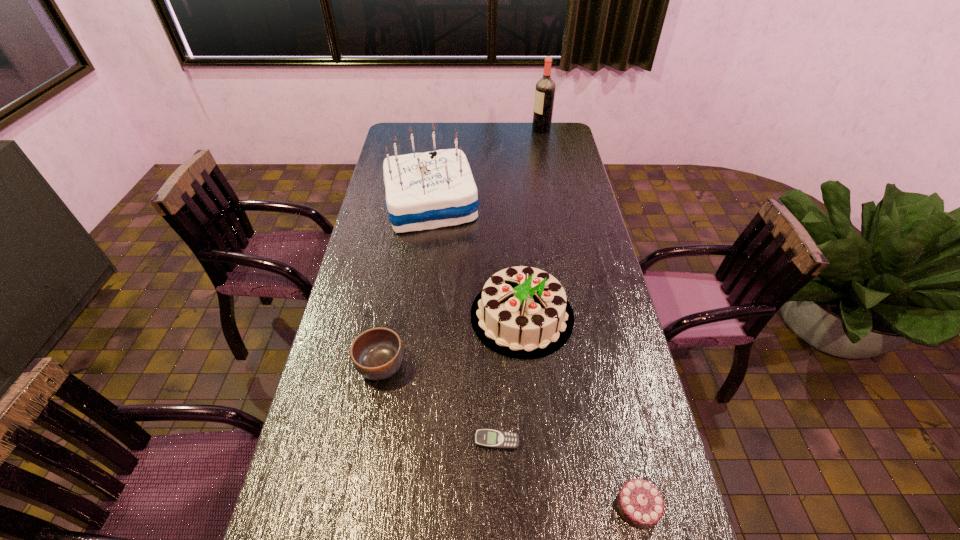
The image size is (960, 540). I want to click on birthday cake situated at the left edge, so coord(429,190).

Where is `bowl located in the left edge section of the desktop`? The height and width of the screenshot is (540, 960). bowl located in the left edge section of the desktop is located at coordinates 377,354.

This screenshot has height=540, width=960. Find the location of `liquor located at the right edge`. liquor located at the right edge is located at coordinates (545, 88).

The width and height of the screenshot is (960, 540). I want to click on birthday cake that is at the right edge, so click(x=522, y=312).

Find the location of a particular element. The width and height of the screenshot is (960, 540). chocolate cake located in the right edge section of the desktop is located at coordinates (639, 502).

The image size is (960, 540). What are the coordinates of `object that is at the far right corner` in the screenshot? It's located at (545, 88).

In the image, there is a desktop. Where is `free region at the left edge`? free region at the left edge is located at coordinates (402, 150).

In the image, there is a desktop. At what (x,y) coordinates should I click in order to perform the action: click on free space at the right edge. Please return your answer as a coordinate pair (x, y). Looking at the image, I should click on [562, 163].

You are a GUI agent. You are given a task and a screenshot of the screen. Output one action in this format:
    pyautogui.click(x=<x>, y=<y>)
    Task: Click on the free space between the third tallest object and the second tallest object
    
    Given the screenshot: What is the action you would take?
    pyautogui.click(x=477, y=261)

The image size is (960, 540). Identify the location of vacant area that lies between the chocolate cake and the liquor. (589, 318).